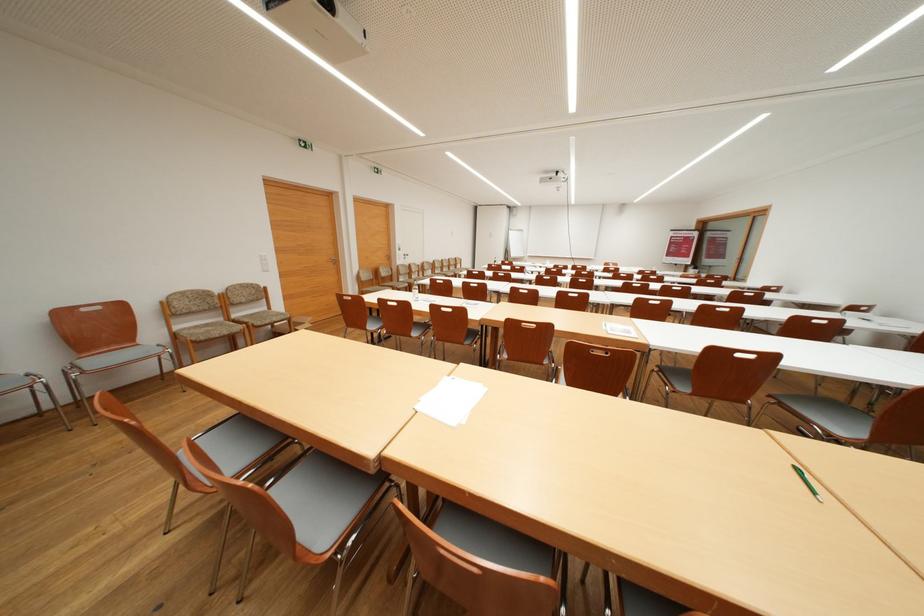
The image size is (924, 616). Describe the element at coordinates (263, 262) in the screenshot. I see `a white light switch` at that location.